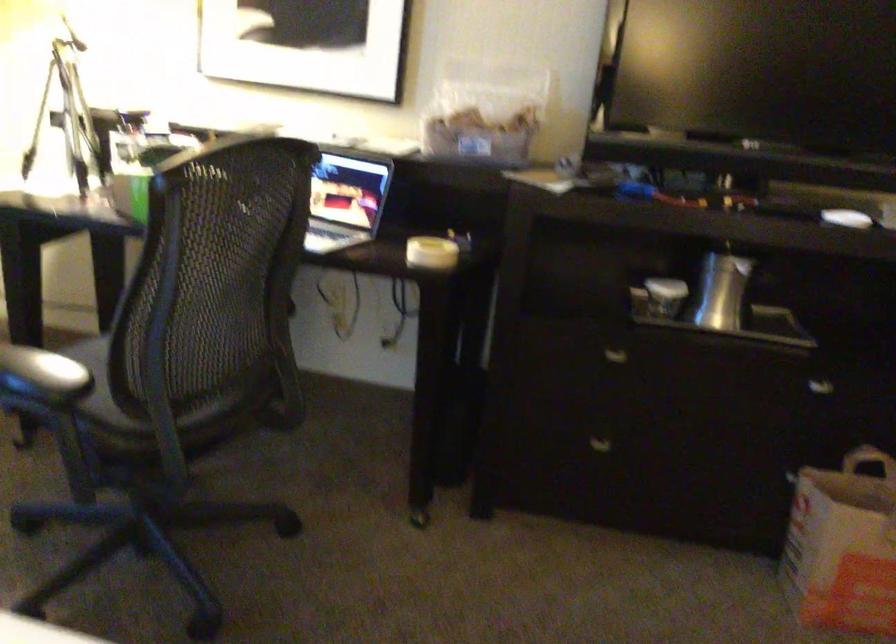
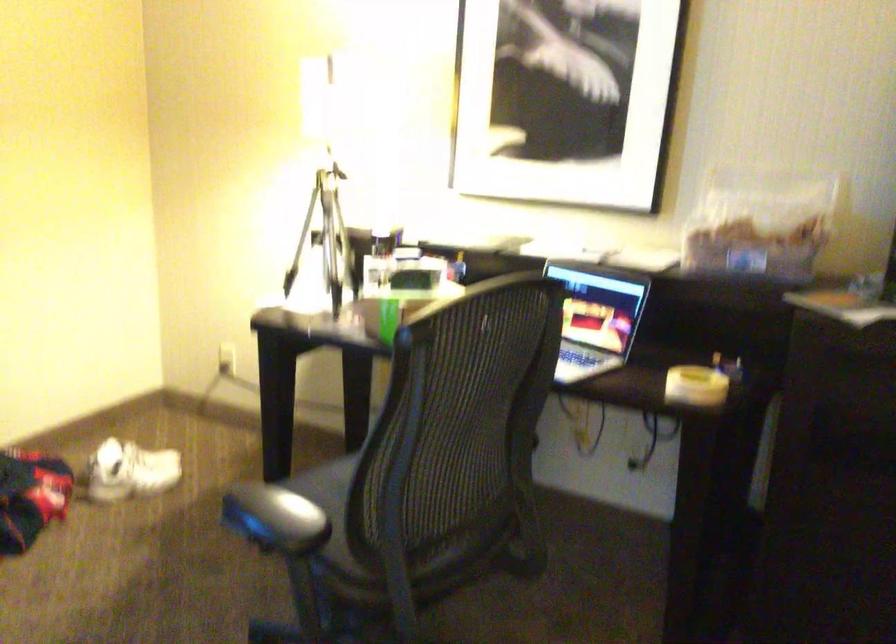
Question: The images are taken continuously from a first-person perspective. In which direction is your viewpoint rotating?

Choices:
 (A) Left
 (B) Right
 (C) Up
 (D) Down

Answer: (A)